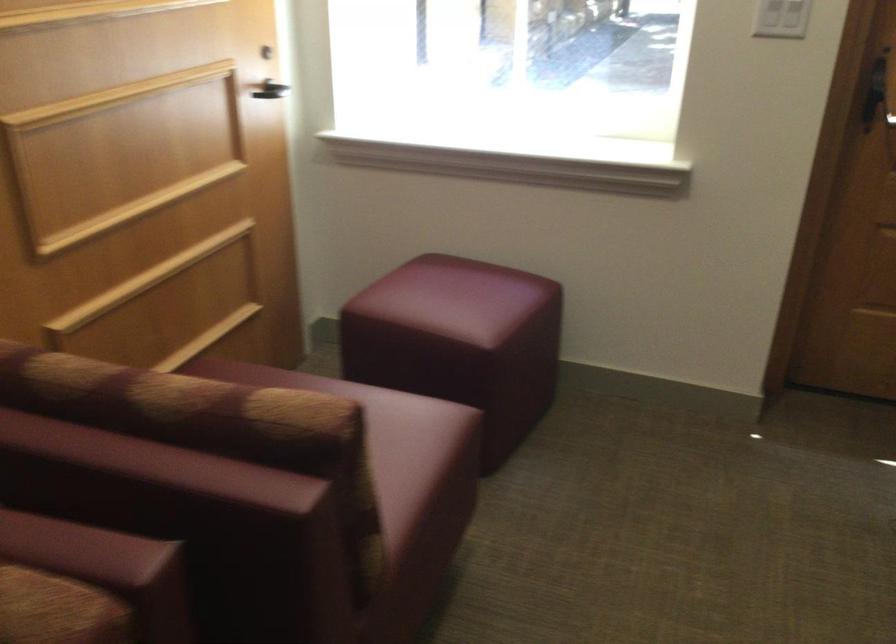
You are a GUI agent. You are given a task and a screenshot of the screen. Output one action in this format:
    pyautogui.click(x=<x>, y=<y>)
    Task: Click on the sofa sitting surface
    The height and width of the screenshot is (644, 896).
    Given the screenshot: What is the action you would take?
    pyautogui.click(x=392, y=444)